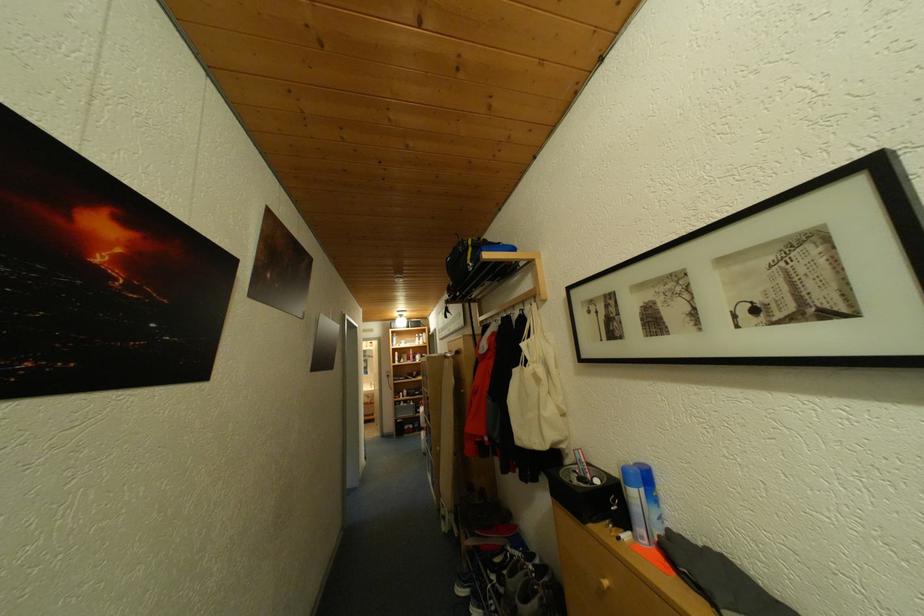
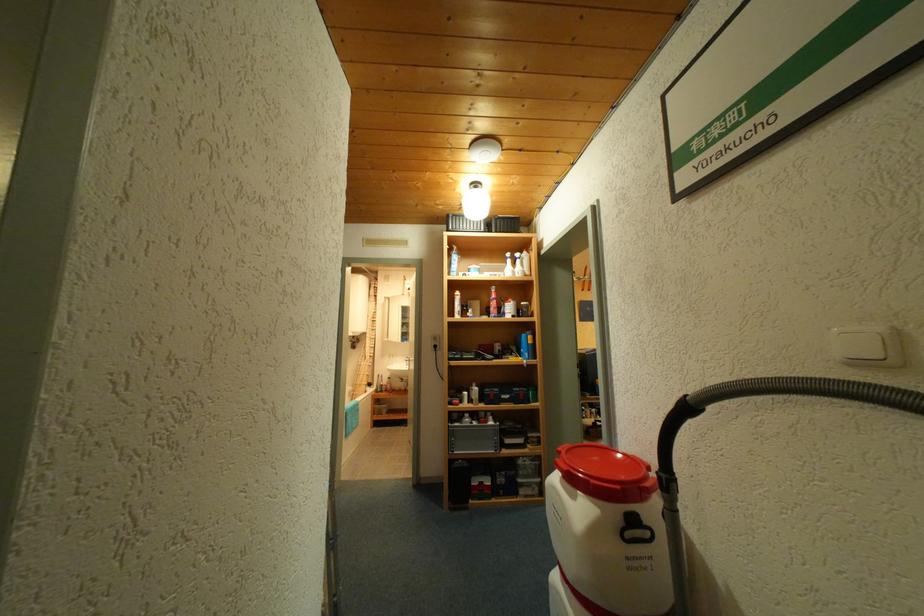
Find the pixel in the second image that matches point 423,342 in the first image.

(512, 270)